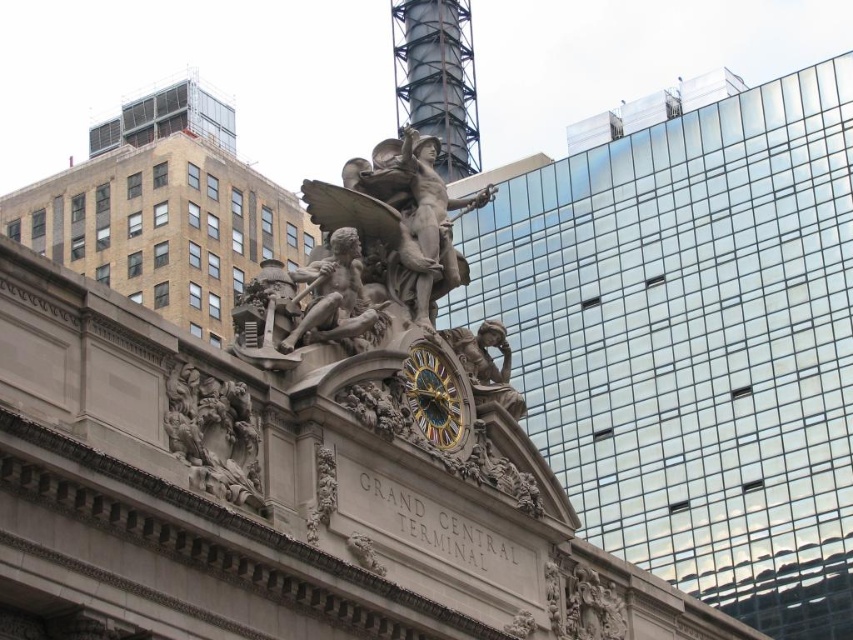
Measure the distance from polished bronze statue at center to gold metallic clock at center.

polished bronze statue at center is 4.62 meters away from gold metallic clock at center.

Is polished bronze statue at center in front of gold metallic clock at center?

That is True.

What do you see at coordinates (334, 298) in the screenshot? The image size is (853, 640). I see `polished bronze statue at center` at bounding box center [334, 298].

Identify the location of polished bronze statue at center. The image size is (853, 640). (334, 298).

Is point (416, 88) behind point (335, 253)?

Yes, it is behind point (335, 253).

Does shiny metallic tower at upper center lie behind polished bronze statue at center?

Yes, it is.

Where is `shiny metallic tower at upper center`? This screenshot has width=853, height=640. shiny metallic tower at upper center is located at coordinates (437, 77).

Which is more to the left, shiny metallic tower at upper center or matte bronze statue at center?

From the viewer's perspective, shiny metallic tower at upper center appears more on the left side.

Consider the image. Is the position of shiny metallic tower at upper center more distant than that of matte bronze statue at center?

Yes, shiny metallic tower at upper center is further from the viewer.

Who is more forward, [428,52] or [473,387]?

Point [473,387]

The image size is (853, 640). I want to click on shiny metallic tower at upper center, so click(x=437, y=77).